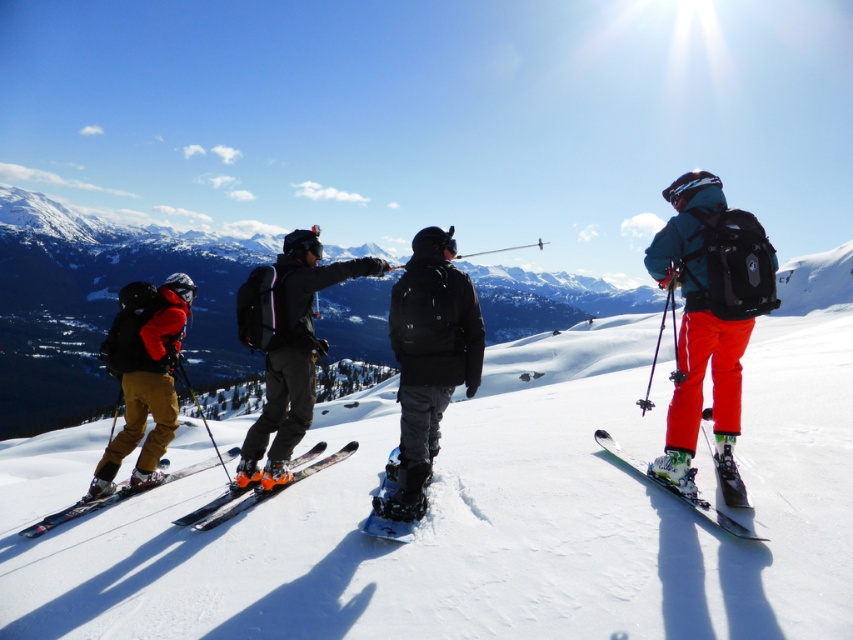
You are a photographer planning to take a photo of the white snowboard at center and the orange metallic skis at center. Based on their positions, which object should you focus on first to capture both in the frame?

The white snowboard at center is positioned on the left side of orange metallic skis at center, so you should focus on the orange metallic skis at center first to ensure both are in the frame.

In the scene shown: You are a photographer standing on a snowy mountain slope. You want to take a photo that includes both the black matte snowboard at center and the orange metallic skis at center. Which object should you focus on first to ensure both are in sharp focus?

The black matte snowboard at center is closer to the viewer than the orange metallic skis at center. To ensure both are in sharp focus, focus on the black matte snowboard at center first since it is closer, and the orange metallic skis at center will fall within the depth of field.